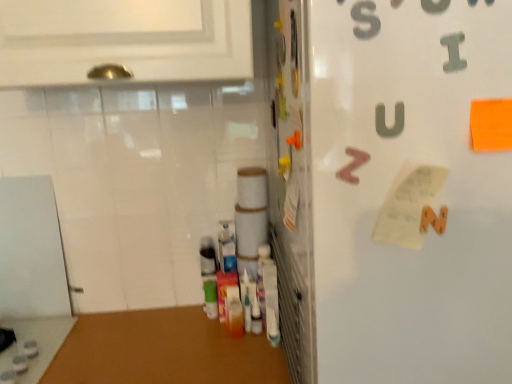
What is the approximate height of brown matte letter z at upper right, arranged as the first alphabet when ordered from the bottom?

2.58 inches.

The width and height of the screenshot is (512, 384). What do you see at coordinates (291, 183) in the screenshot?
I see `metallic silver door at center` at bounding box center [291, 183].

The height and width of the screenshot is (384, 512). What are the coordinates of `brown matte letter z at upper right, the first alphabet viewed from the left` in the screenshot? It's located at (352, 165).

Is white matte refrigerator at right positioned far away from white paper at center-right?

That's not correct — white matte refrigerator at right is a little close to white paper at center-right.

Who is bigger, white matte refrigerator at right or white paper at center-right?

white matte refrigerator at right.

From the image's perspective, between white matte refrigerator at right and white paper at center-right, who is located below?

From the image's view, white matte refrigerator at right is below.

Consider the image. Considering the relative sizes of white paper at center-right and white matte refrigerator at right in the image provided, is white paper at center-right shorter than white matte refrigerator at right?

Indeed, white paper at center-right has a lesser height compared to white matte refrigerator at right.

Is white paper at center-right located outside white matte refrigerator at right?

No, white paper at center-right is inside white matte refrigerator at right's boundary.

In the scene shown: Is white paper at center-right to the right of white matte refrigerator at right from the viewer's perspective?

In fact, white paper at center-right is to the left of white matte refrigerator at right.

Which of these two, white paper at center-right or white matte refrigerator at right, is bigger?

With larger size is white matte refrigerator at right.

Is white matte refrigerator at right bigger or smaller than metallic gray letter i at upper right, acting as the 2th alphabet starting from the back?

Considering their sizes, white matte refrigerator at right takes up more space than metallic gray letter i at upper right, acting as the 2th alphabet starting from the back.

Is white matte refrigerator at right aimed at metallic gray letter i at upper right, the first alphabet in the top-to-bottom sequence?

Yes, white matte refrigerator at right is oriented towards metallic gray letter i at upper right, the first alphabet in the top-to-bottom sequence.

Locate an element on the screen. Image resolution: width=512 pixels, height=384 pixels. paper below the metallic silver door at center (from a real-world perspective) is located at coordinates (411, 207).

Is point (271, 36) more distant than point (397, 220)?

Yes, point (271, 36) is farther from viewer.

How many degrees apart are the facing directions of metallic silver door at center and white paper at center-right?

The angle between the facing direction of metallic silver door at center and the facing direction of white paper at center-right is 90.4 degrees.

How distant is metallic silver door at center from white paper at center-right?

metallic silver door at center and white paper at center-right are 12.15 inches apart from each other.

Based on the photo, does metallic silver door at center come in front of metallic gray letter i at upper right, the 2th alphabet when ordered from bottom to top?

No, metallic silver door at center is further to the viewer.

Which point is more distant from viewer, (283, 296) or (459, 43)?

The point (283, 296) is farther.

From the picture: Would you say metallic silver door at center is inside or outside metallic gray letter i at upper right, the 2th alphabet when ordered from bottom to top?

metallic silver door at center cannot be found inside metallic gray letter i at upper right, the 2th alphabet when ordered from bottom to top.

Does metallic silver door at center appear on the left side of metallic gray letter i at upper right, the 2th alphabet when ordered from bottom to top?

Yes.

Is brown matte letter z at upper right, which is the 1th alphabet in back-to-front order, oriented away from metallic silver door at center?

Yes, metallic silver door at center is at the back of brown matte letter z at upper right, which is the 1th alphabet in back-to-front order.

Considering the positions of objects brown matte letter z at upper right, which appears as the 2th alphabet when viewed from the front, and metallic silver door at center in the image provided, who is behind, brown matte letter z at upper right, which appears as the 2th alphabet when viewed from the front, or metallic silver door at center?

brown matte letter z at upper right, which appears as the 2th alphabet when viewed from the front, is behind.

Can you confirm if brown matte letter z at upper right, the first alphabet viewed from the left, is thinner than metallic silver door at center?

Yes.

Which of these two, white paper at center-right or brown matte letter z at upper right, the first alphabet viewed from the left, is bigger?

white paper at center-right is bigger.

Is white paper at center-right further to the viewer compared to brown matte letter z at upper right, arranged as the first alphabet when ordered from the bottom?

That is False.

Based on the photo, which object is positioned more to the left, white paper at center-right or brown matte letter z at upper right, arranged as the first alphabet when ordered from the bottom?

Positioned to the left is brown matte letter z at upper right, arranged as the first alphabet when ordered from the bottom.

You are a GUI agent. You are given a task and a screenshot of the screen. Output one action in this format:
    pyautogui.click(x=<x>, y=<y>)
    Task: Click on the paper on the left of the white matte refrigerator at right
    The image size is (512, 384).
    Given the screenshot: What is the action you would take?
    pyautogui.click(x=411, y=207)

The height and width of the screenshot is (384, 512). I want to click on refrigerator below the white paper at center-right (from the image's perspective), so click(x=392, y=189).

Based on the photo, when comparing their distances from brown matte letter z at upper right, which appears as the 2th alphabet when viewed from the front, does metallic gray letter i at upper right, marked as the first alphabet in a right-to-left arrangement, or white matte refrigerator at right seem further?

Based on the image, metallic gray letter i at upper right, marked as the first alphabet in a right-to-left arrangement, appears to be further to brown matte letter z at upper right, which appears as the 2th alphabet when viewed from the front.

Looking at this image, considering their positions, is white paper at center-right positioned closer to metallic silver door at center than white matte refrigerator at right?

Based on the image, white matte refrigerator at right appears to be nearer to metallic silver door at center.

Looking at this image, from the image, which object appears to be farther from white matte refrigerator at right, metallic silver door at center or brown matte letter z at upper right, arranged as the first alphabet when ordered from the bottom?

brown matte letter z at upper right, arranged as the first alphabet when ordered from the bottom, is further to white matte refrigerator at right.

From the image, which object appears to be farther from white matte refrigerator at right, brown matte letter z at upper right, which appears as the 2th alphabet when viewed from the front, or metallic silver door at center?

brown matte letter z at upper right, which appears as the 2th alphabet when viewed from the front.

When comparing their distances from white paper at center-right, does brown matte letter z at upper right, arranged as the first alphabet when ordered from the bottom, or metallic silver door at center seem closer?

Based on the image, brown matte letter z at upper right, arranged as the first alphabet when ordered from the bottom, appears to be nearer to white paper at center-right.

Based on their spatial positions, is white matte refrigerator at right or white paper at center-right closer to brown matte letter z at upper right, which ranks as the 2th alphabet in top-to-bottom order?

Among the two, white paper at center-right is located nearer to brown matte letter z at upper right, which ranks as the 2th alphabet in top-to-bottom order.

From the image, which object appears to be nearer to metallic gray letter i at upper right, the first alphabet positioned from the front, brown matte letter z at upper right, which ranks as the 2th alphabet in top-to-bottom order, or metallic silver door at center?

brown matte letter z at upper right, which ranks as the 2th alphabet in top-to-bottom order.

Looking at the image, which one is located closer to metallic silver door at center, brown matte letter z at upper right, which is the 1th alphabet in back-to-front order, or metallic gray letter i at upper right, arranged as the second alphabet when viewed from the left?

brown matte letter z at upper right, which is the 1th alphabet in back-to-front order, is positioned closer to the anchor metallic silver door at center.

Locate an element on the screen. paper between metallic silver door at center and white matte refrigerator at right from top to bottom is located at coordinates (411, 207).

Where is `paper between metallic gray letter i at upper right, the 2th alphabet when ordered from bottom to top, and white matte refrigerator at right in the up-down direction`? paper between metallic gray letter i at upper right, the 2th alphabet when ordered from bottom to top, and white matte refrigerator at right in the up-down direction is located at coordinates (411, 207).

You are a GUI agent. You are given a task and a screenshot of the screen. Output one action in this format:
    pyautogui.click(x=<x>, y=<y>)
    Task: Click on the alphabet located between metallic silver door at center and white paper at center-right in the left-right direction
    The width and height of the screenshot is (512, 384).
    Given the screenshot: What is the action you would take?
    pyautogui.click(x=352, y=165)

The width and height of the screenshot is (512, 384). In order to click on alphabet between metallic gray letter i at upper right, marked as the first alphabet in a right-to-left arrangement, and white paper at center-right from top to bottom in this screenshot , I will do `click(352, 165)`.